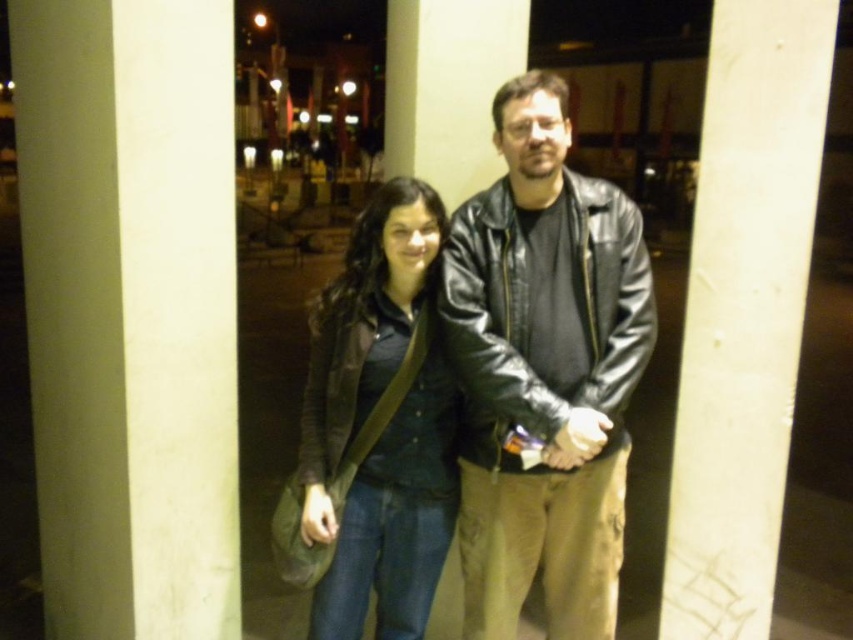
Is white smooth pillar at left positioned before black leather jacket at center?

Yes.

What do you see at coordinates (131, 310) in the screenshot? The width and height of the screenshot is (853, 640). I see `white smooth pillar at left` at bounding box center [131, 310].

Find the location of `white smooth pillar at left`. white smooth pillar at left is located at coordinates (131, 310).

Can you confirm if white smooth pillar at center is smaller than matte brown jacket at center?

No.

Is white smooth pillar at center above matte brown jacket at center?

Yes, white smooth pillar at center is above matte brown jacket at center.

You are a GUI agent. You are given a task and a screenshot of the screen. Output one action in this format:
    pyautogui.click(x=<x>, y=<y>)
    Task: Click on the white smooth pillar at center
    The height and width of the screenshot is (640, 853).
    Given the screenshot: What is the action you would take?
    pyautogui.click(x=744, y=312)

Is point (570, 205) farther from camera compared to point (741, 266)?

That is False.

Who is more distant from viewer, (541, 394) or (670, 496)?

Positioned behind is point (670, 496).

You are a GUI agent. You are given a task and a screenshot of the screen. Output one action in this format:
    pyautogui.click(x=<x>, y=<y>)
    Task: Click on the black leather jacket at center
    
    Given the screenshot: What is the action you would take?
    pyautogui.click(x=544, y=371)